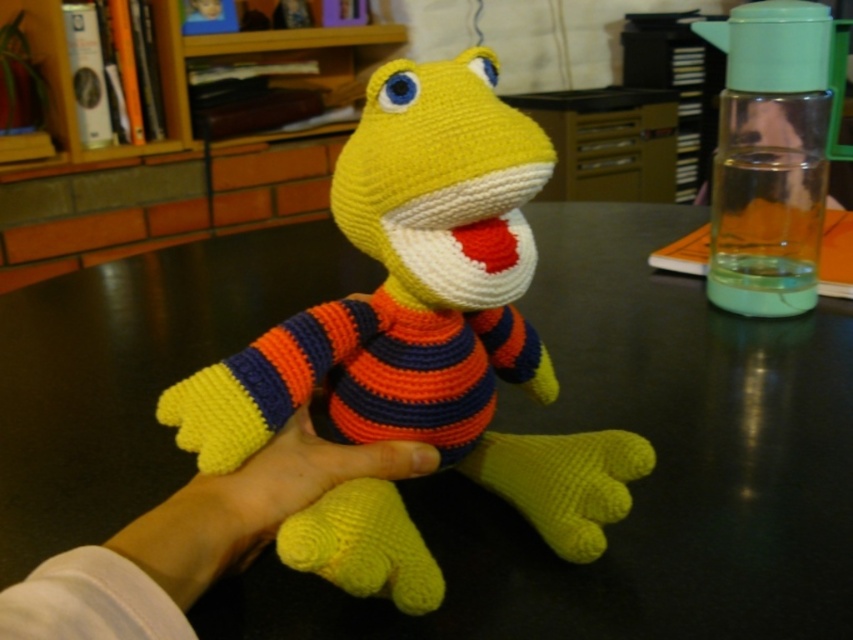
Between yellow yarn toy at center and yellow yarn at lower center, which one has less height?

yellow yarn at lower center is shorter.

Which is behind, point (584, 493) or point (225, 522)?

The point (584, 493) is more distant.

What do you see at coordinates (427, 312) in the screenshot? The height and width of the screenshot is (640, 853). I see `yellow yarn toy at center` at bounding box center [427, 312].

Image resolution: width=853 pixels, height=640 pixels. Identify the location of yellow yarn toy at center. (427, 312).

Who is more forward, (239,506) or (305,493)?

Point (239,506) is more forward.

Is yellow yarn hand at center positioned in front of yellow yarn at lower center?

That is True.

The height and width of the screenshot is (640, 853). What do you see at coordinates (192, 540) in the screenshot? I see `yellow yarn hand at center` at bounding box center [192, 540].

The image size is (853, 640). In order to click on yellow yarn hand at center in this screenshot , I will do `click(192, 540)`.

Between point (730, 317) and point (270, 513), which one is positioned behind?

The point (730, 317) is more distant.

Locate an element on the screen. The height and width of the screenshot is (640, 853). black glossy table at center is located at coordinates (634, 481).

Find the location of a particular element. black glossy table at center is located at coordinates (634, 481).